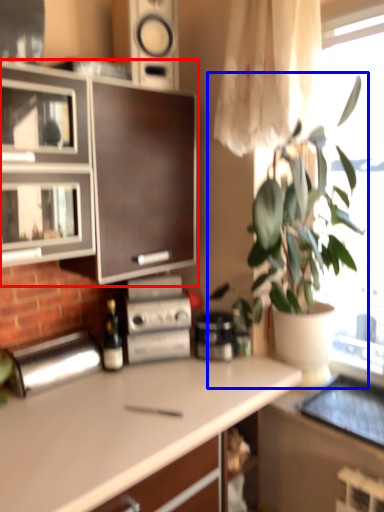
Question: Which object appears farthest to the camera in this image, cabinetry (highlighted by a red box) or houseplant (highlighted by a blue box)?

Choices:
 (A) cabinetry
 (B) houseplant

Answer: (A)